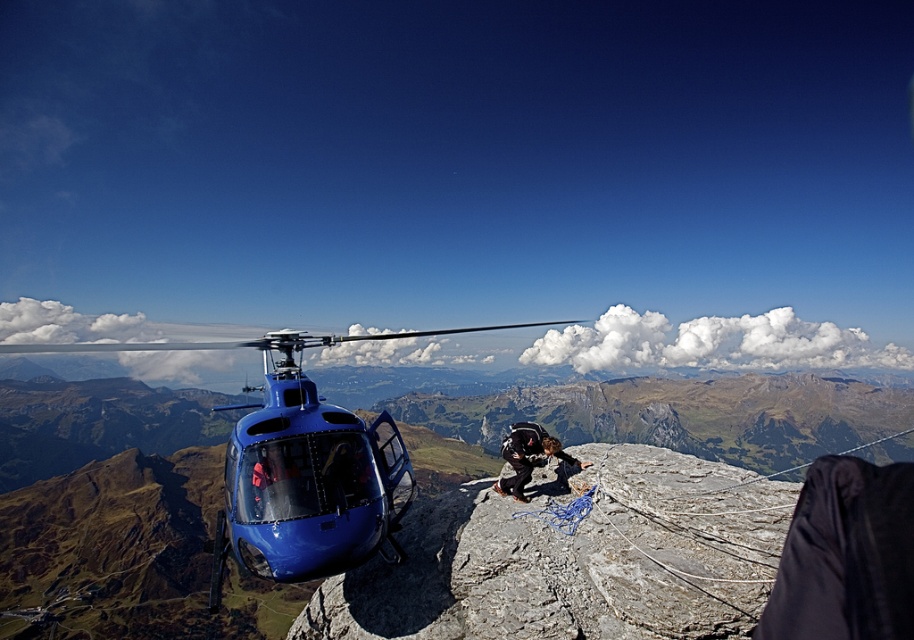
In the scene shown: You are a passenger in the blue glossy helicopter at center. You notice a rough textured rock at center above you. Is the rock above or below the helicopter?

The rough textured rock at center is positioned over the blue glossy helicopter at center, so the rock is above the helicopter.

Based on the photo, you are a hiker who wants to reach the helicopter. You see the rough textured rock at center and the black fabric jacket at center. Which object is closer to you?

The rough textured rock at center is closer to you because it is in front of the black fabric jacket at center.